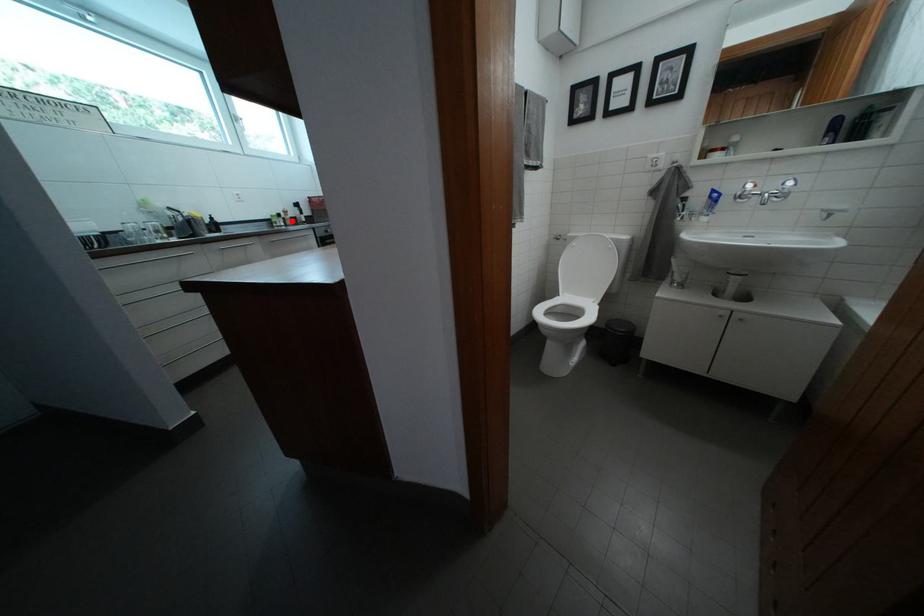
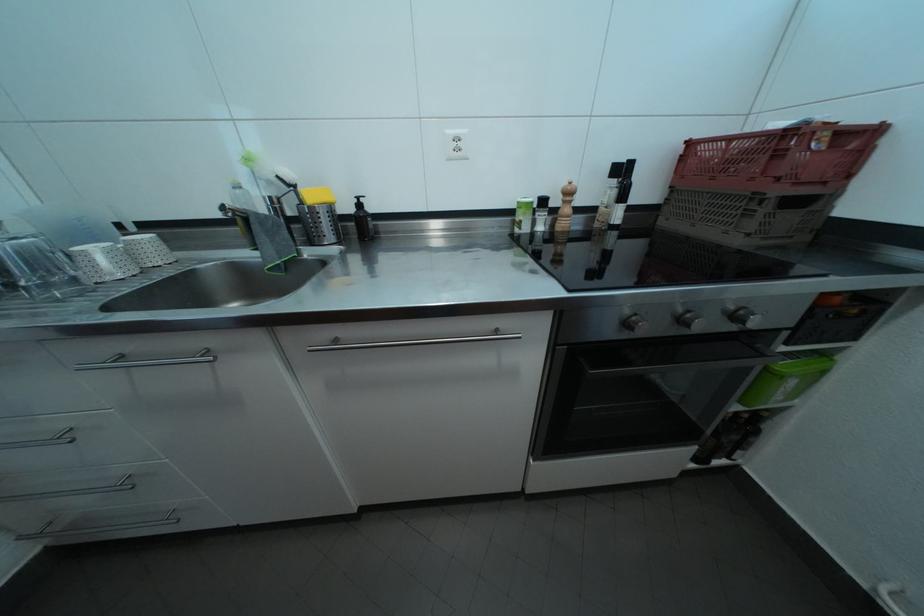
Find the pixel in the second image that matches the highlighted location in the first image.

(564, 208)